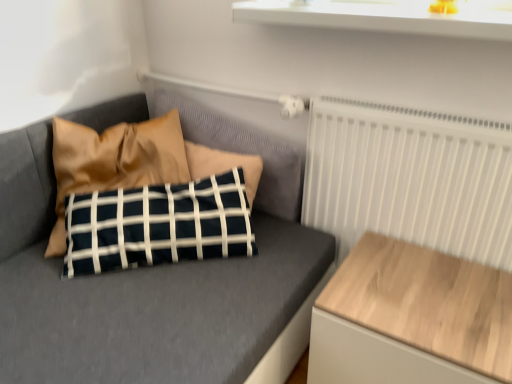
Question: From the image's perspective, is white glossy window sill at upper center under wooden table at right?

Choices:
 (A) no
 (B) yes

Answer: (A)

Question: Can you confirm if white glossy window sill at upper center is thinner than wooden table at right?

Choices:
 (A) no
 (B) yes

Answer: (B)

Question: Is white glossy window sill at upper center looking in the opposite direction of wooden table at right?

Choices:
 (A) no
 (B) yes

Answer: (A)

Question: Can you confirm if white glossy window sill at upper center is wider than wooden table at right?

Choices:
 (A) no
 (B) yes

Answer: (A)

Question: From the image's perspective, does white glossy window sill at upper center appear higher than wooden table at right?

Choices:
 (A) no
 (B) yes

Answer: (B)

Question: Would you say wooden table at right is to the left or to the right of satin brown pillow at upper left in the picture?

Choices:
 (A) left
 (B) right

Answer: (B)

Question: Considering the positions of wooden table at right and satin brown pillow at upper left in the image, is wooden table at right wider or thinner than satin brown pillow at upper left?

Choices:
 (A) wide
 (B) thin

Answer: (A)

Question: In terms of height, does wooden table at right look taller or shorter compared to satin brown pillow at upper left?

Choices:
 (A) short
 (B) tall

Answer: (A)

Question: From the image's perspective, relative to satin brown pillow at upper left, is wooden table at right above or below?

Choices:
 (A) below
 (B) above

Answer: (A)

Question: Is point (165, 350) closer or farther from the camera than point (164, 173)?

Choices:
 (A) farther
 (B) closer

Answer: (B)

Question: From the image's perspective, is matte black pillow at center positioned above or below satin brown pillow at upper left?

Choices:
 (A) below
 (B) above

Answer: (A)

Question: Considering the positions of matte black pillow at center and satin brown pillow at upper left in the image, is matte black pillow at center bigger or smaller than satin brown pillow at upper left?

Choices:
 (A) small
 (B) big

Answer: (B)

Question: Considering the relative positions of matte black pillow at center and satin brown pillow at upper left in the image provided, is matte black pillow at center to the left or to the right of satin brown pillow at upper left?

Choices:
 (A) left
 (B) right

Answer: (B)

Question: Looking at the image, does wooden table at right seem bigger or smaller compared to matte black pillow at center?

Choices:
 (A) big
 (B) small

Answer: (B)

Question: In the image, is wooden table at right positioned in front of or behind matte black pillow at center?

Choices:
 (A) behind
 (B) front

Answer: (B)